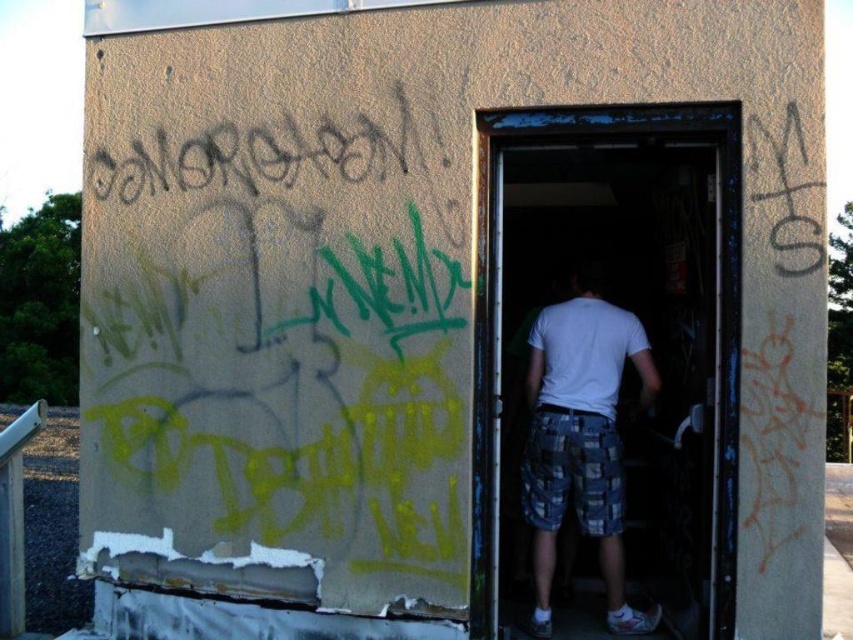
Does wooden door at center have a greater width compared to white cotton shirt at center?

Yes, wooden door at center is wider than white cotton shirt at center.

From the picture: Does wooden door at center have a lesser width compared to white cotton shirt at center?

No, wooden door at center is not thinner than white cotton shirt at center.

You are a GUI agent. You are given a task and a screenshot of the screen. Output one action in this format:
    pyautogui.click(x=<x>, y=<y>)
    Task: Click on the wooden door at center
    The width and height of the screenshot is (853, 640).
    Given the screenshot: What is the action you would take?
    pyautogui.click(x=606, y=371)